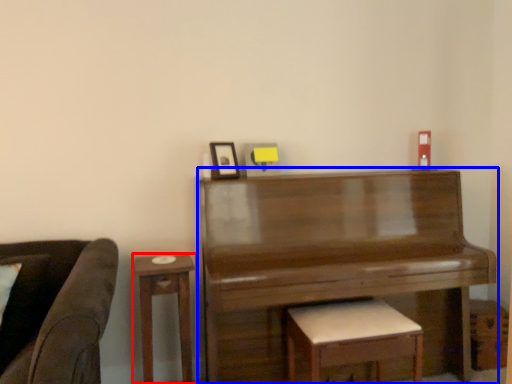
Question: Which point is closer to the camera, table (highlighted by a red box) or piano (highlighted by a blue box)?

Choices:
 (A) table
 (B) piano

Answer: (B)